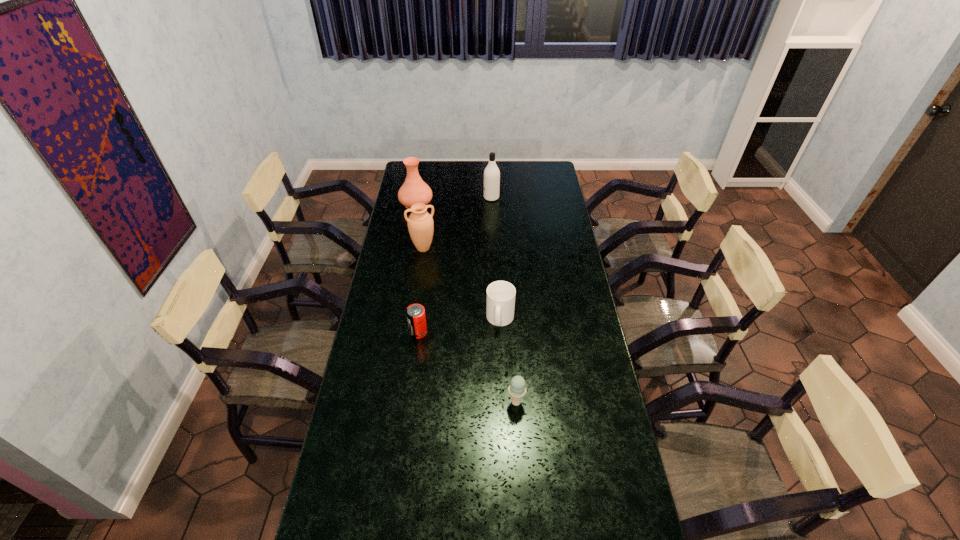
Find the location of a particular element. This screenshot has height=540, width=960. free region located 0.260m on the right of the urn is located at coordinates (493, 248).

Locate an element on the screen. The image size is (960, 540). free space located on the handle side of the mug is located at coordinates (505, 434).

Where is `vacant region located on the left of the ice cream`? The width and height of the screenshot is (960, 540). vacant region located on the left of the ice cream is located at coordinates (402, 402).

Find the location of a particular element. The height and width of the screenshot is (540, 960). vacant space located on the right of the can is located at coordinates (456, 333).

The height and width of the screenshot is (540, 960). Find the location of `vase at the left edge`. vase at the left edge is located at coordinates (414, 190).

You are a GUI agent. You are given a task and a screenshot of the screen. Output one action in this format:
    pyautogui.click(x=<x>, y=<y>)
    Task: Click on the urn present at the left edge
    The width and height of the screenshot is (960, 540).
    Given the screenshot: What is the action you would take?
    pyautogui.click(x=420, y=223)

The image size is (960, 540). In the image, there is a desktop. In order to click on vacant space at the far edge in this screenshot , I will do `click(453, 168)`.

Locate an element on the screen. The height and width of the screenshot is (540, 960). vacant space at the left edge is located at coordinates (385, 320).

This screenshot has width=960, height=540. Identify the location of vacant space at the right edge of the desktop. (539, 215).

Where is `free space at the far left corner`? free space at the far left corner is located at coordinates (432, 164).